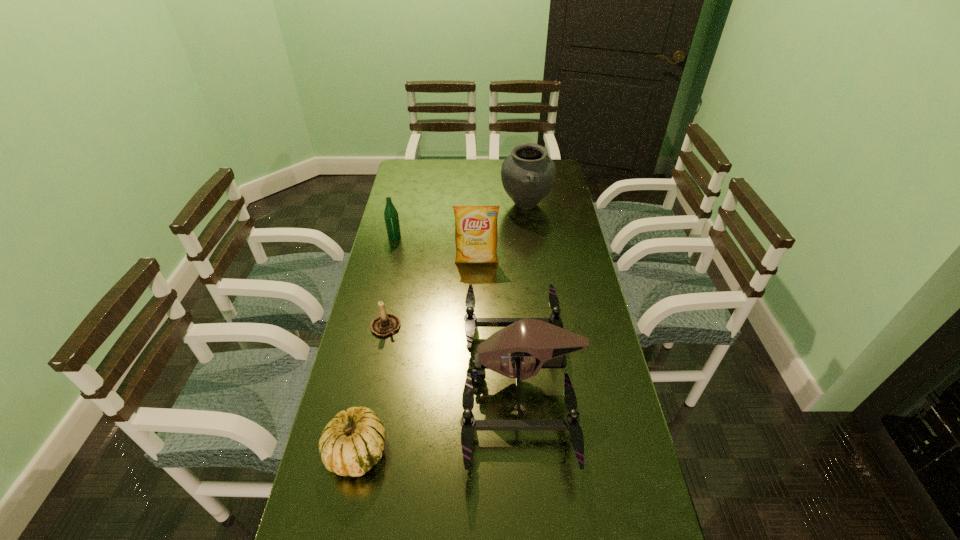
Where is `vacant space at the far edge`? vacant space at the far edge is located at coordinates (492, 173).

Identify the location of vacant space at the left edge of the desktop. (399, 305).

Locate an element on the screen. free location at the right edge is located at coordinates (590, 367).

Image resolution: width=960 pixels, height=540 pixels. In the image, there is a desktop. In order to click on free space at the far left corner in this screenshot , I will do `click(421, 163)`.

Where is `vacant area between the candle holder and the gourd`? The height and width of the screenshot is (540, 960). vacant area between the candle holder and the gourd is located at coordinates (372, 389).

The image size is (960, 540). Identify the location of free space between the candle holder and the gourd. (372, 389).

Find the location of a particular element. This screenshot has height=540, width=960. blank region between the urn and the third farthest object is located at coordinates (501, 232).

Find the location of a particular element. The width and height of the screenshot is (960, 540). vacant space that is in between the drone and the urn is located at coordinates (523, 292).

Locate an element on the screen. Image resolution: width=960 pixels, height=540 pixels. free space between the drone and the candle holder is located at coordinates (453, 353).

Where is `free point between the candle holder and the drone`? The height and width of the screenshot is (540, 960). free point between the candle holder and the drone is located at coordinates tap(453, 353).